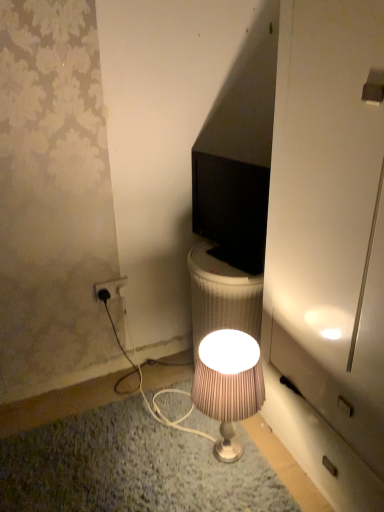
Question: Does point (200, 223) appear closer or farther from the camera than point (122, 286)?

Choices:
 (A) farther
 (B) closer

Answer: (B)

Question: Considering the relative positions of black glossy monitor at center and white plastic power outlet at lower left in the image provided, is black glossy monitor at center to the left or to the right of white plastic power outlet at lower left?

Choices:
 (A) left
 (B) right

Answer: (B)

Question: Which object is the farthest from the black glossy monitor at center?

Choices:
 (A) white plastic power outlet at lower left
 (B) silky beige lampshade at center

Answer: (A)

Question: Based on their relative distances, which object is farther from the silky beige lampshade at center?

Choices:
 (A) white plastic power outlet at lower left
 (B) black glossy monitor at center

Answer: (A)